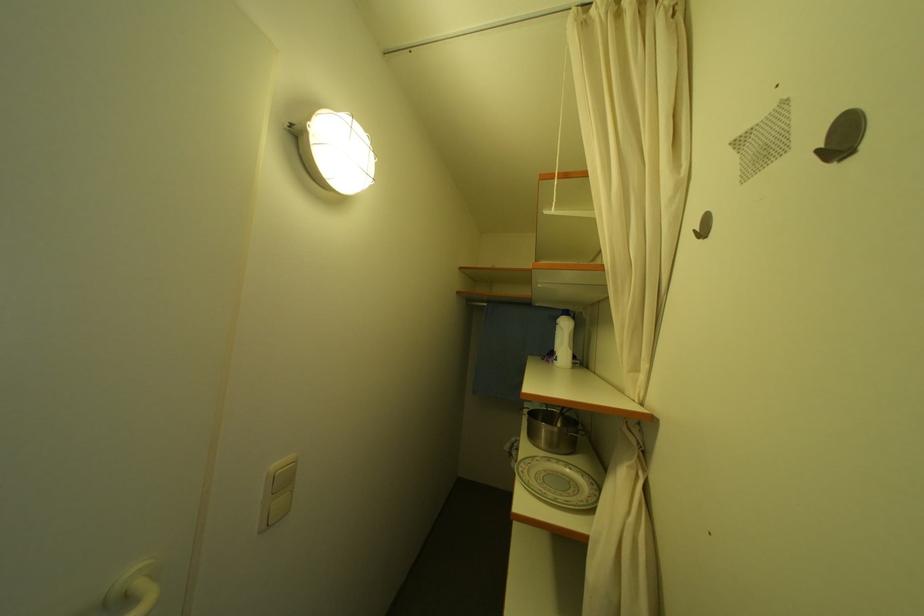
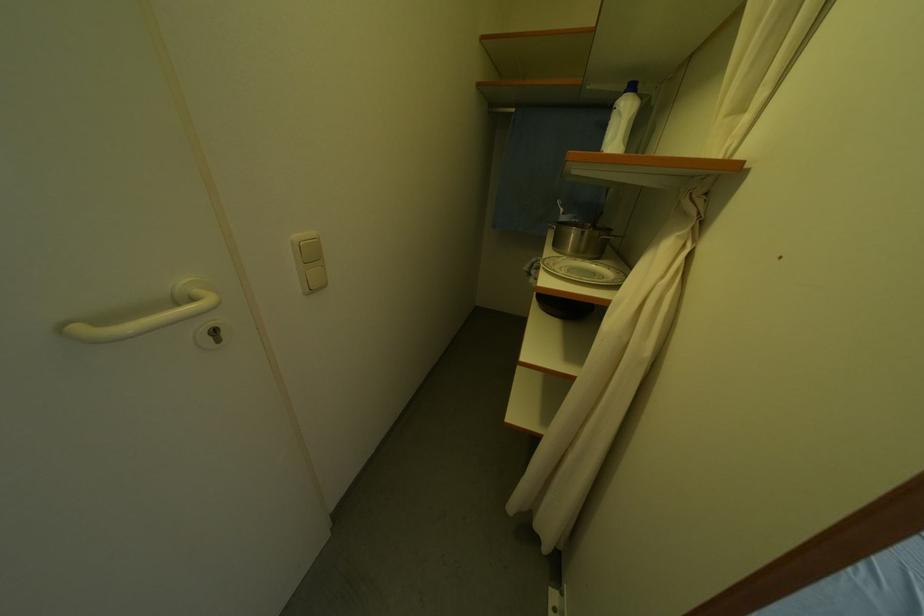
In the second image, find the point that corresponds to point 284,469 in the first image.

(306, 238)